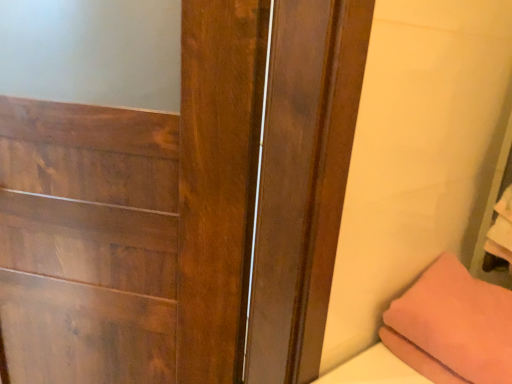
This screenshot has height=384, width=512. I want to click on pink fabric pillow at lower right, so click(x=452, y=326).

Measure the distance between point (451, 364) and camera.

Point (451, 364) is 30.20 inches from camera.

Describe the element at coordinates (452, 326) in the screenshot. I see `pink fabric pillow at lower right` at that location.

What is the approximate height of wooden door at center?

It is 37.19 inches.

Describe the element at coordinates (187, 208) in the screenshot. I see `wooden door at center` at that location.

The width and height of the screenshot is (512, 384). I want to click on wooden door at center, so click(x=187, y=208).

Where is `pink fabric pillow at lower right`? The width and height of the screenshot is (512, 384). pink fabric pillow at lower right is located at coordinates (452, 326).

Is pink fabric pillow at lower right to the right of wooden door at center from the viewer's perspective?

Indeed, pink fabric pillow at lower right is positioned on the right side of wooden door at center.

Does pink fabric pillow at lower right lie in front of wooden door at center?

No, pink fabric pillow at lower right is further to the viewer.

Which is closer, (498,324) or (271,183)?

Point (271,183)

From the image's perspective, relative to wooden door at center, is pink fabric pillow at lower right above or below?

pink fabric pillow at lower right is situated lower than wooden door at center in the image.

From a real-world perspective, is pink fabric pillow at lower right positioned under wooden door at center based on gravity?

Correct, in the physical world, pink fabric pillow at lower right is lower than wooden door at center.

Is pink fabric pillow at lower right thinner than wooden door at center?

No, pink fabric pillow at lower right is not thinner than wooden door at center.

Is pink fabric pillow at lower right shorter than wooden door at center?

Yes, pink fabric pillow at lower right is shorter than wooden door at center.

Which of these two, pink fabric pillow at lower right or wooden door at center, is bigger?

Bigger between the two is wooden door at center.

Does pink fabric pillow at lower right contain wooden door at center?

No.

Is pink fabric pillow at lower right directly adjacent to wooden door at center?

pink fabric pillow at lower right and wooden door at center are not in contact.

Could you tell me if pink fabric pillow at lower right is facing wooden door at center?

No, pink fabric pillow at lower right is not aimed at wooden door at center.

What's the angular difference between pink fabric pillow at lower right and wooden door at center's facing directions?

41.3 degrees separate the facing orientations of pink fabric pillow at lower right and wooden door at center.

Measure the distance between pink fabric pillow at lower right and wooden door at center.

The distance of pink fabric pillow at lower right from wooden door at center is 16.96 inches.

Identify the location of pillow behind the wooden door at center. (452, 326).

Between wooden door at center and pink fabric pillow at lower right, which one appears on the right side from the viewer's perspective?

pink fabric pillow at lower right.

Relative to pink fabric pillow at lower right, is wooden door at center in front or behind?

Clearly, wooden door at center is in front of pink fabric pillow at lower right.

Which is behind, point (118, 367) or point (480, 332)?

The point (118, 367) is farther.

From the image's perspective, is wooden door at center above pink fabric pillow at lower right?

Yes, from the image's perspective, wooden door at center is over pink fabric pillow at lower right.

From a real-world perspective, is wooden door at center physically above pink fabric pillow at lower right?

Yes, from a real-world perspective, wooden door at center is on top of pink fabric pillow at lower right.

In terms of width, does wooden door at center look wider or thinner when compared to pink fabric pillow at lower right?

wooden door at center is thinner than pink fabric pillow at lower right.

Is wooden door at center shorter than pink fabric pillow at lower right?

In fact, wooden door at center may be taller than pink fabric pillow at lower right.

Considering the sizes of objects wooden door at center and pink fabric pillow at lower right in the image provided, who is smaller, wooden door at center or pink fabric pillow at lower right?

pink fabric pillow at lower right is smaller.

Is wooden door at center not inside pink fabric pillow at lower right?

Yes, wooden door at center is outside of pink fabric pillow at lower right.

Is wooden door at center not close to pink fabric pillow at lower right?

They are positioned close to each other.

Does wooden door at center turn towards pink fabric pillow at lower right?

No, wooden door at center is not turned towards pink fabric pillow at lower right.

Locate an element on the screen. Image resolution: width=512 pixels, height=384 pixels. door above the pink fabric pillow at lower right (from a real-world perspective) is located at coordinates pos(187,208).

You are a GUI agent. You are given a task and a screenshot of the screen. Output one action in this format:
    pyautogui.click(x=<x>, y=<y>)
    Task: Click on the door above the pink fabric pillow at lower right (from the image's perspective)
    This screenshot has width=512, height=384.
    Given the screenshot: What is the action you would take?
    coord(187,208)

You are a GUI agent. You are given a task and a screenshot of the screen. Output one action in this format:
    pyautogui.click(x=<x>, y=<y>)
    Task: Click on the door lying in front of the pink fabric pillow at lower right
    
    Given the screenshot: What is the action you would take?
    pyautogui.click(x=187, y=208)